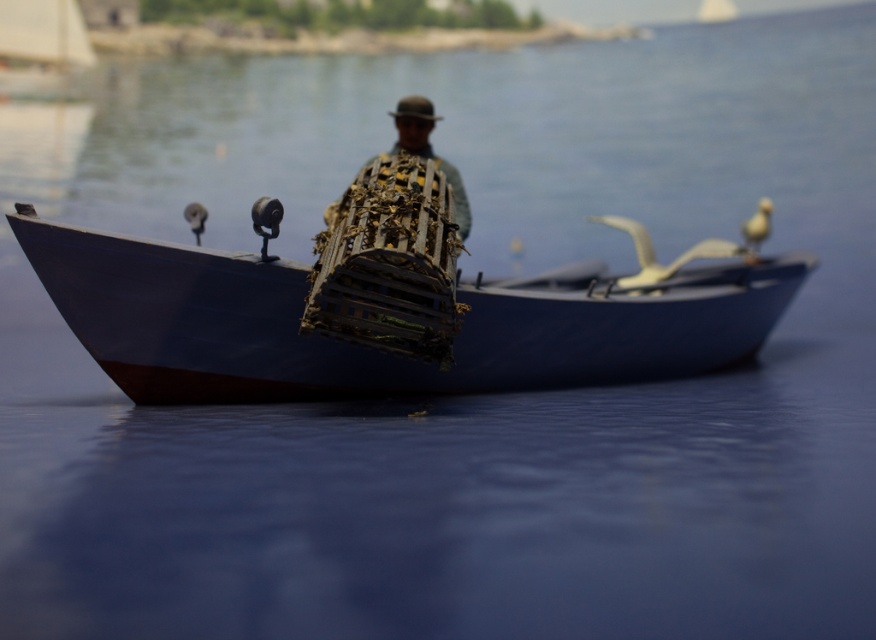
You are standing on the deck of a boat and want to reach a specific point marked at coordinates point (x=733, y=246). If your arm can extend 4 feet, can you comfortably reach that point without moving your position?

The distance of point (x=733, y=246) from camera is 5.13 feet, which is further than your arm can reach. You cannot comfortably reach it without moving.

You are a photographer aiming to capture the white feathered bird at upper right in the center of your photo. Given the bird is at coordinates point 0.353, 0.865, what direction should you move your camera to center it?

To center the white feathered bird at upper right, move the camera slightly to the left and down since the bird is located at coordinates point (x=757, y=225) which is to the upper right of the frame.